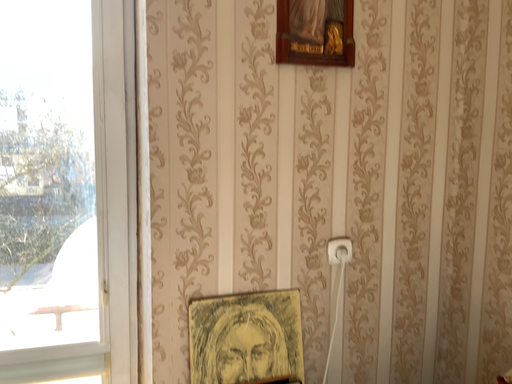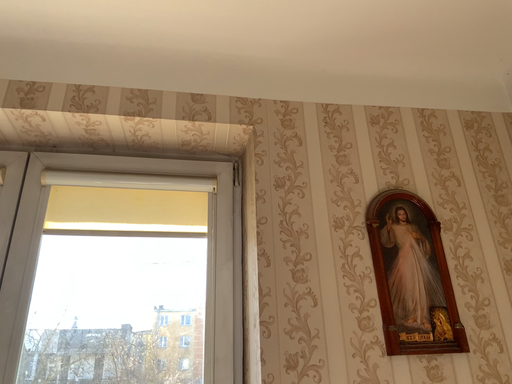
Question: Which way did the camera rotate in the video?

Choices:
 (A) rotated left
 (B) rotated right

Answer: (A)